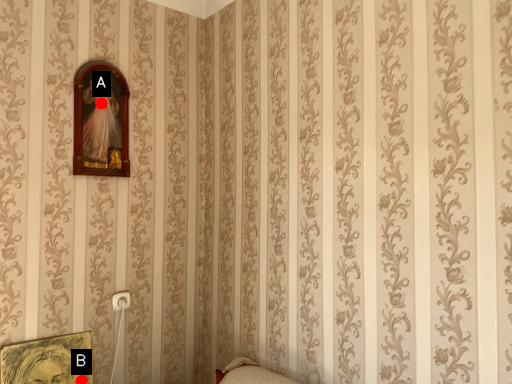
Question: Two points are circled on the image, labeled by A and B beside each circle. Which point is closer to the camera?

Choices:
 (A) A is closer
 (B) B is closer

Answer: (B)